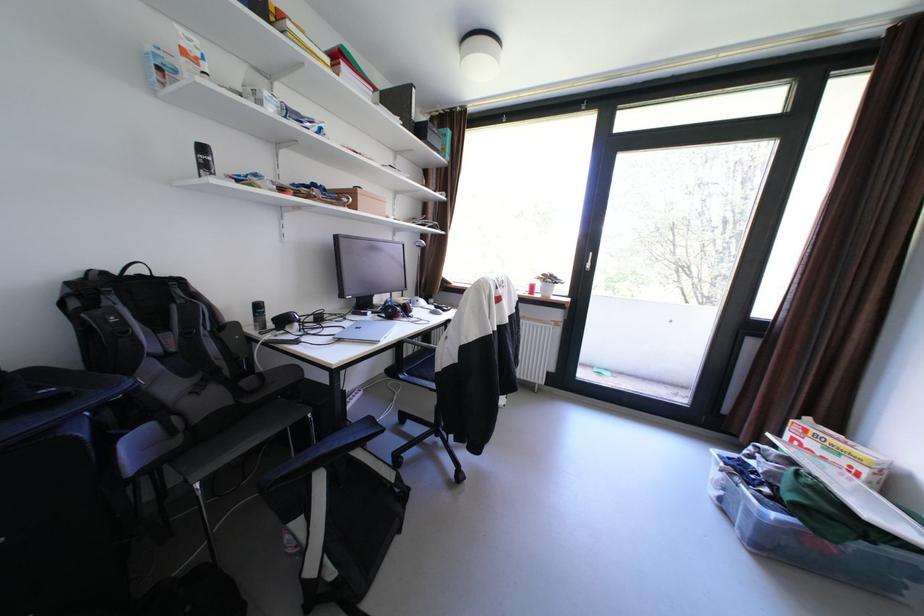
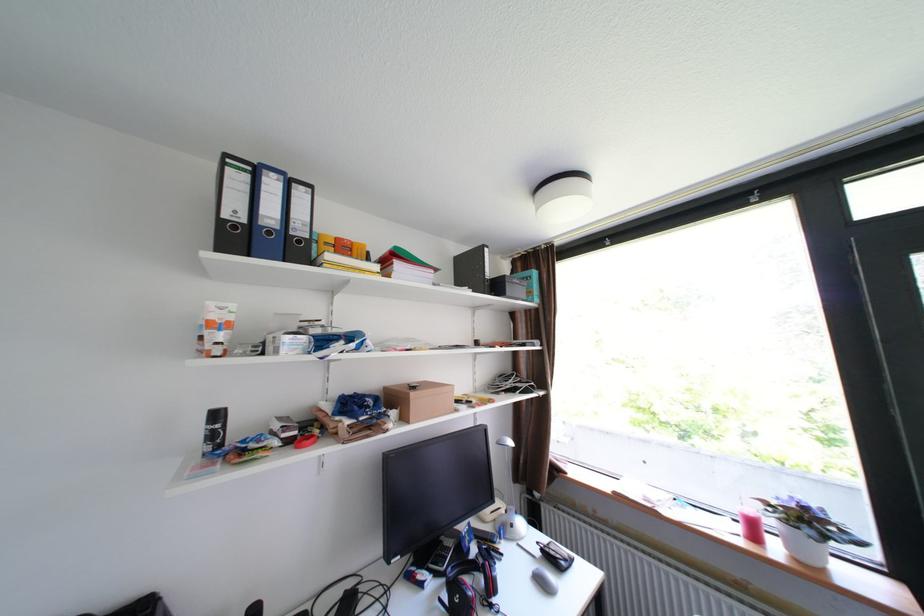
Where in the second image is the point corresponding to (x=445, y=306) from the first image?

(553, 551)